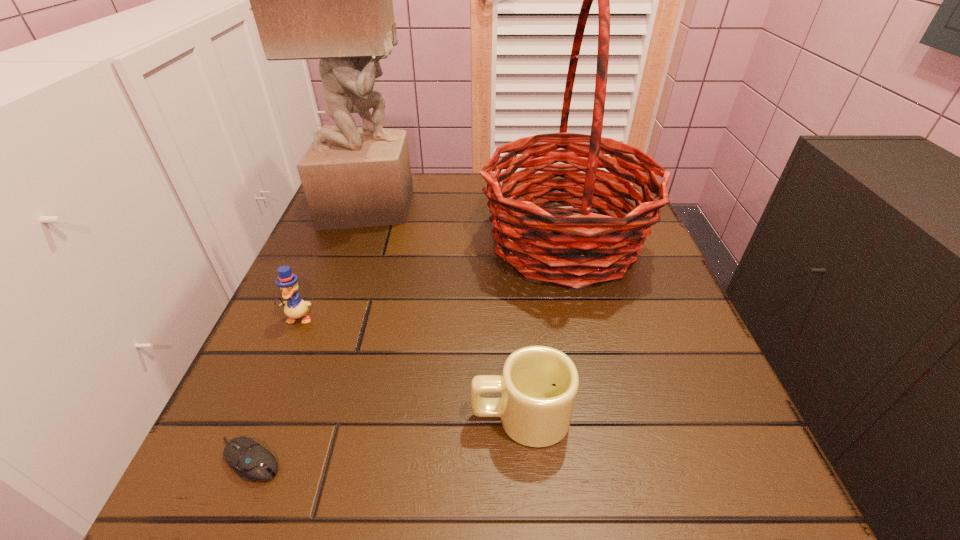
Where is `sculpture`? This screenshot has height=540, width=960. sculpture is located at coordinates (331, 0).

Where is `basket`? basket is located at coordinates (572, 254).

The height and width of the screenshot is (540, 960). I want to click on duckling, so click(294, 307).

Where is `mug`? The image size is (960, 540). mug is located at coordinates (539, 384).

The width and height of the screenshot is (960, 540). I want to click on the shortest object, so click(251, 461).

Where is `blank space located 0.080m on the front-facing side of the sculpture`? The width and height of the screenshot is (960, 540). blank space located 0.080m on the front-facing side of the sculpture is located at coordinates (446, 206).

I want to click on vacant space situated on the back of the basket, so click(x=548, y=176).

This screenshot has height=540, width=960. I want to click on free location located 0.080m on the face of the third farthest object, where the monocle is placed, so click(x=279, y=363).

I want to click on vacant space situated 0.330m with the handle on the side of the mug, so click(247, 416).

Where is `vacant space located with the handle on the side of the mug`? Image resolution: width=960 pixels, height=540 pixels. vacant space located with the handle on the side of the mug is located at coordinates (402, 416).